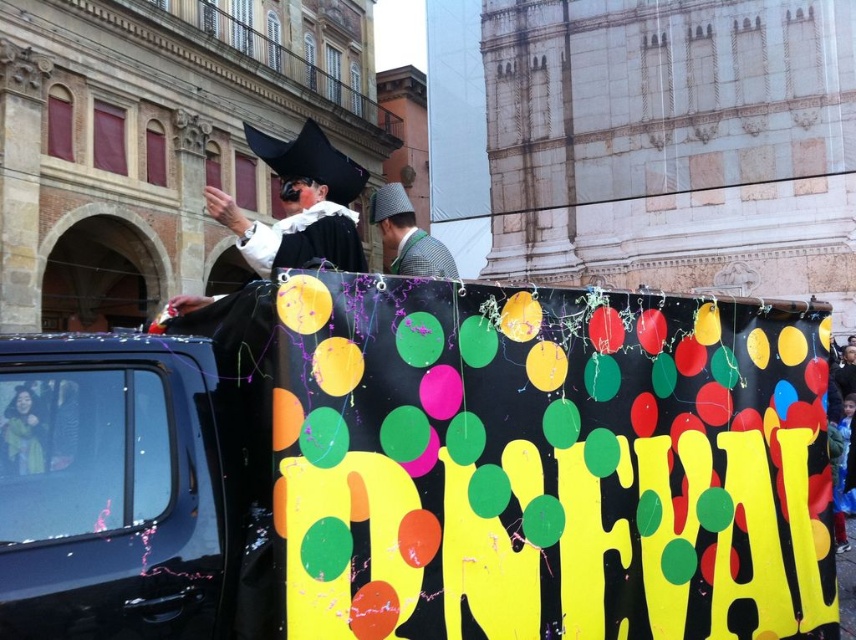
Does glossy blue car at left lie in front of matte black costume at center?

Yes, glossy blue car at left is closer to the viewer.

Where is `glossy blue car at left`? glossy blue car at left is located at coordinates (110, 488).

Can you confirm if glossy blue car at left is positioned below checkered fabric hat at center?

Correct, glossy blue car at left is located below checkered fabric hat at center.

Can you confirm if glossy blue car at left is positioned above checkered fabric hat at center?

No.

Which is in front, point (39, 406) or point (432, 240)?

Point (39, 406)

The width and height of the screenshot is (856, 640). What are the coordinates of `glossy blue car at left` in the screenshot? It's located at (x=110, y=488).

Can you confirm if checkered fabric hat at center is shorter than satin black robe at center?

Incorrect, checkered fabric hat at center's height does not fall short of satin black robe at center's.

Locate an element on the screen. The width and height of the screenshot is (856, 640). checkered fabric hat at center is located at coordinates (407, 236).